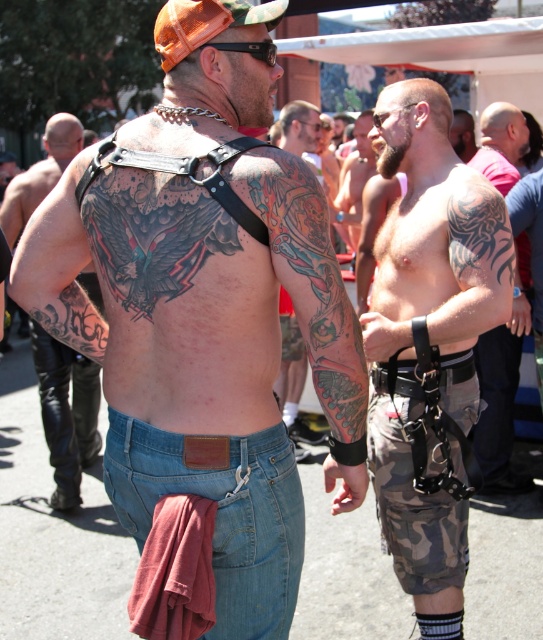
Is colorful tattooed arm at center below black tattooed arm at upper left?

Yes, colorful tattooed arm at center is below black tattooed arm at upper left.

Who is taller, colorful tattooed arm at center or black tattooed arm at upper left?

Standing taller between the two is colorful tattooed arm at center.

Which is behind, point (292, 173) or point (15, 237)?

Positioned behind is point (15, 237).

Image resolution: width=543 pixels, height=640 pixels. What are the coordinates of `colorful tattooed arm at center` in the screenshot? It's located at (312, 285).

Looking at this image, is colorful tattooed arm at upper center bigger than shiny black belt at center?

No.

What do you see at coordinates (293, 378) in the screenshot?
I see `colorful tattooed arm at upper center` at bounding box center [293, 378].

Locate an element on the screen. The width and height of the screenshot is (543, 640). colorful tattooed arm at upper center is located at coordinates (293, 378).

The image size is (543, 640). Describe the element at coordinates (430, 342) in the screenshot. I see `camo shorts at right` at that location.

Who is taller, camo shorts at right or orange mesh baseball cap at upper center?

camo shorts at right is taller.

Identify the location of camo shorts at right. The image size is (543, 640). (430, 342).